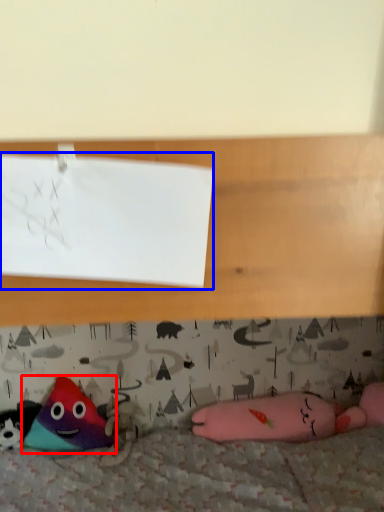
Question: Which object appears closest to the camera in this image, toy (highlighted by a red box) or paper (highlighted by a blue box)?

Choices:
 (A) toy
 (B) paper

Answer: (B)